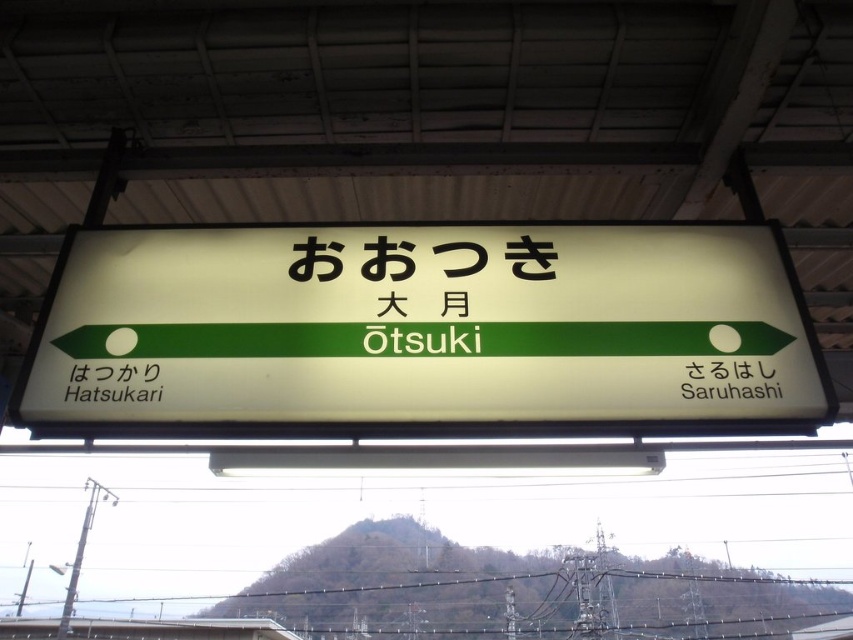
Question: Which object is closer to the camera taking this photo?

Choices:
 (A) black plastic sign at upper center
 (B) white plastic sign at center

Answer: (B)

Question: Among these objects, which one is farthest from the camera?

Choices:
 (A) white plastic sign at center
 (B) white paper at lower left

Answer: (B)

Question: Is white paper at lower left wider than black plastic sign at upper center?

Choices:
 (A) no
 (B) yes

Answer: (B)

Question: Which object is farther from the camera taking this photo?

Choices:
 (A) black plastic sign at upper center
 (B) white paper at lower left

Answer: (B)

Question: Does white plastic sign at center appear over white paper at lower left?

Choices:
 (A) yes
 (B) no

Answer: (A)

Question: Can you confirm if white plastic sign at center is smaller than white paper at lower left?

Choices:
 (A) no
 (B) yes

Answer: (A)